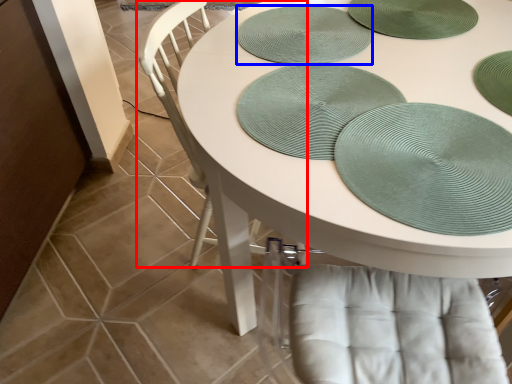
Question: Which of the following is the closest to the observer, chair (highlighted by a red box) or platter (highlighted by a blue box)?

Choices:
 (A) chair
 (B) platter

Answer: (A)